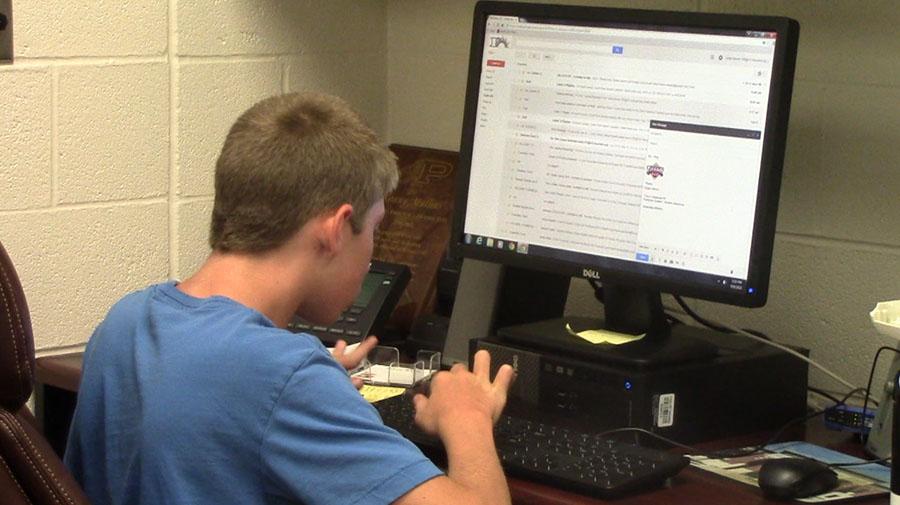
Locate an element on the screen. This screenshot has height=505, width=900. mouse is located at coordinates click(799, 497).